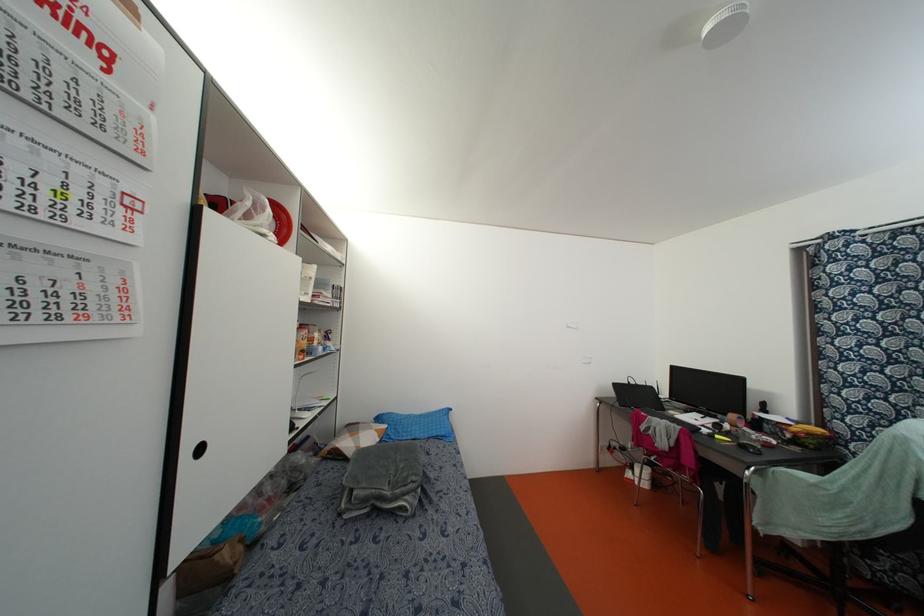
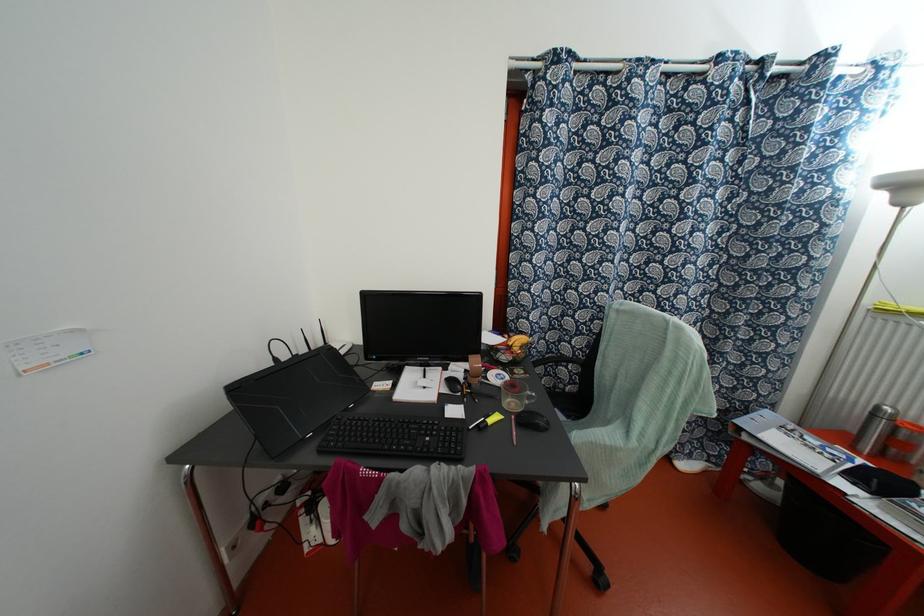
Find the pixel in the second image that matches (x=786, y=436) in the first image.

(504, 357)